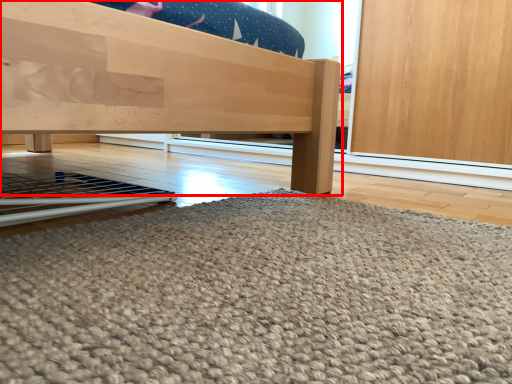
Question: From the image's perspective, what is the correct spatial positioning of furniture (annotated by the red box) in reference to door?

Choices:
 (A) below
 (B) above

Answer: (B)